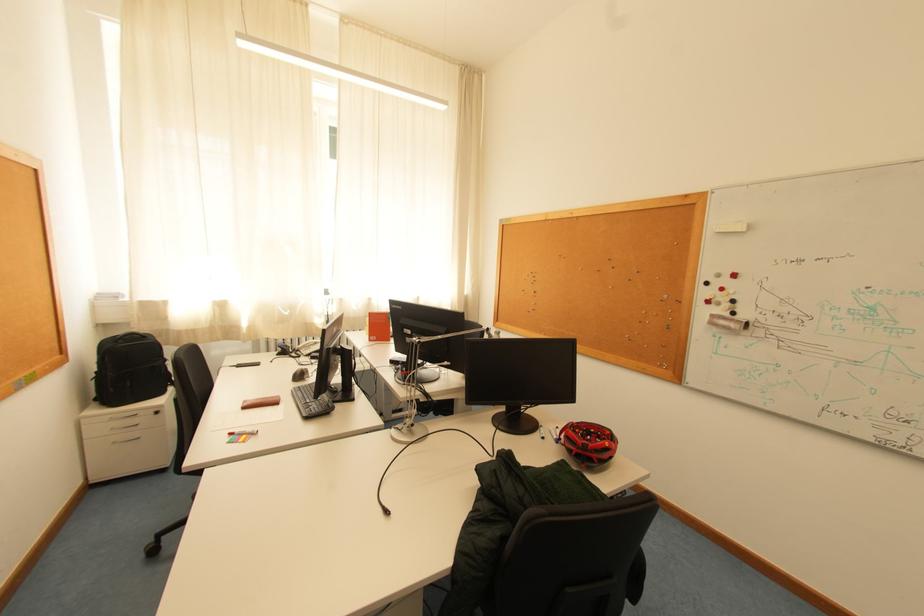
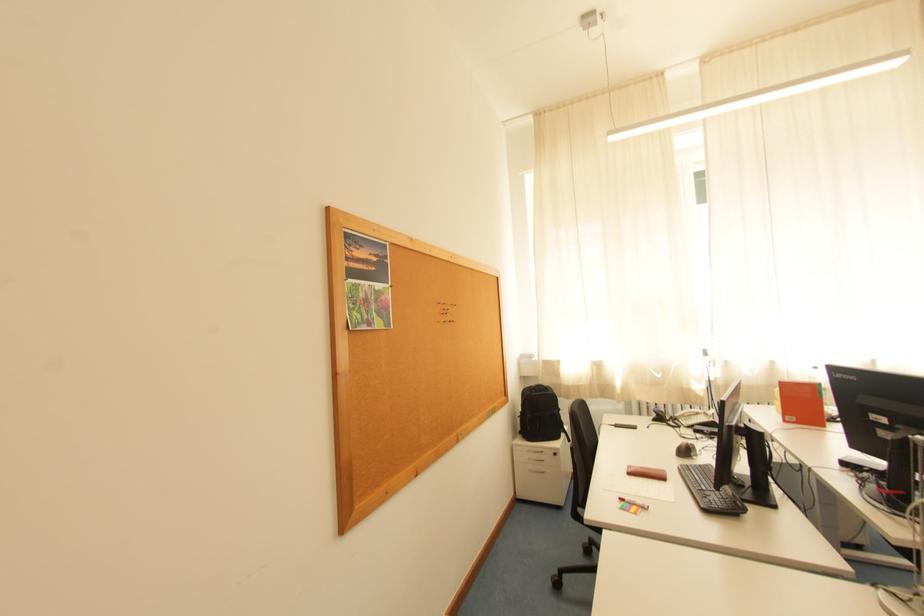
Question: The camera is either moving clockwise (left) or counter-clockwise (right) around the object. The first image is from the beginning of the video and the second image is from the end. Is the camera moving left or right when shooting the video?

Choices:
 (A) Left
 (B) Right

Answer: (B)